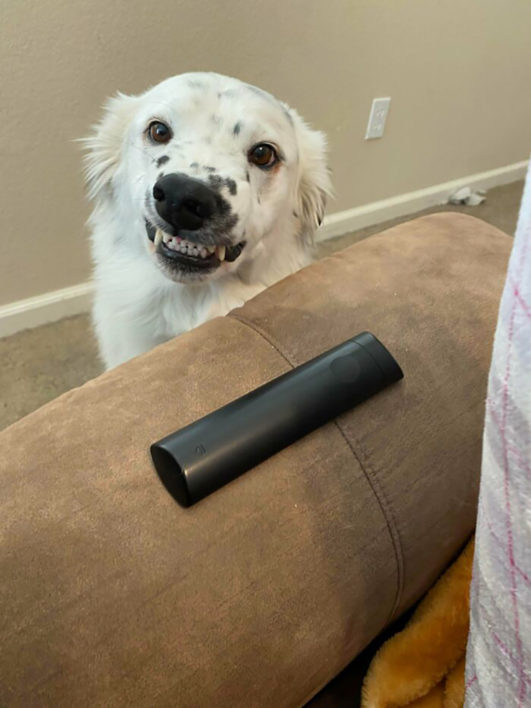
At what (x,y) coordinates should I click in order to perform the action: click on electrical socket. Please return your answer as a coordinate pair (x, y). Image resolution: width=531 pixels, height=708 pixels. Looking at the image, I should click on (369, 130).